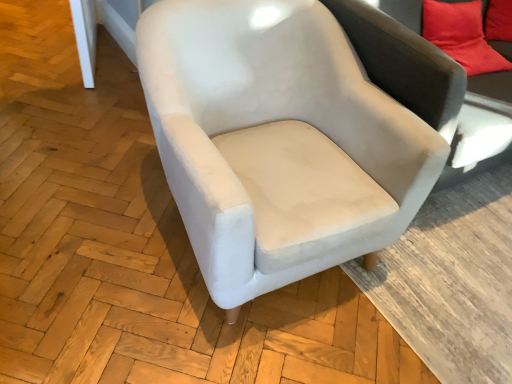
Question: Does velvet-like gray couch at upper right have a greater width compared to velvet beige swivel chair at center?

Choices:
 (A) yes
 (B) no

Answer: (B)

Question: From the image's perspective, does velvet-like gray couch at upper right appear higher than velvet beige swivel chair at center?

Choices:
 (A) yes
 (B) no

Answer: (A)

Question: Would you say velvet-like gray couch at upper right contains velvet beige swivel chair at center?

Choices:
 (A) no
 (B) yes

Answer: (A)

Question: Does velvet-like gray couch at upper right have a smaller size compared to velvet beige swivel chair at center?

Choices:
 (A) yes
 (B) no

Answer: (A)

Question: Is velvet-like gray couch at upper right shorter than velvet beige swivel chair at center?

Choices:
 (A) no
 (B) yes

Answer: (B)

Question: Visually, is velvet-like gray couch at upper right positioned to the left or to the right of suede-like beige armchair at center?

Choices:
 (A) left
 (B) right

Answer: (B)

Question: Do you think velvet-like gray couch at upper right is within suede-like beige armchair at center, or outside of it?

Choices:
 (A) outside
 (B) inside

Answer: (A)

Question: Looking at the image, does velvet-like gray couch at upper right seem bigger or smaller compared to suede-like beige armchair at center?

Choices:
 (A) small
 (B) big

Answer: (A)

Question: From a real-world perspective, is velvet-like gray couch at upper right physically located above or below suede-like beige armchair at center?

Choices:
 (A) above
 (B) below

Answer: (A)

Question: Considering the relative positions of velvet-like gray couch at upper right and velvet red pillow at upper right in the image provided, is velvet-like gray couch at upper right to the left or to the right of velvet red pillow at upper right?

Choices:
 (A) right
 (B) left

Answer: (B)

Question: Which is correct: velvet-like gray couch at upper right is inside velvet red pillow at upper right, or outside of it?

Choices:
 (A) outside
 (B) inside

Answer: (A)

Question: Is point (482, 11) positioned closer to the camera than point (471, 21)?

Choices:
 (A) farther
 (B) closer

Answer: (A)

Question: Is velvet-like gray couch at upper right wider or thinner than velvet red pillow at upper right?

Choices:
 (A) wide
 (B) thin

Answer: (A)

Question: Looking at the image, does velvet beige swivel chair at center seem bigger or smaller compared to velvet red pillow at upper right?

Choices:
 (A) small
 (B) big

Answer: (B)

Question: Is velvet beige swivel chair at center spatially inside velvet red pillow at upper right, or outside of it?

Choices:
 (A) outside
 (B) inside

Answer: (A)